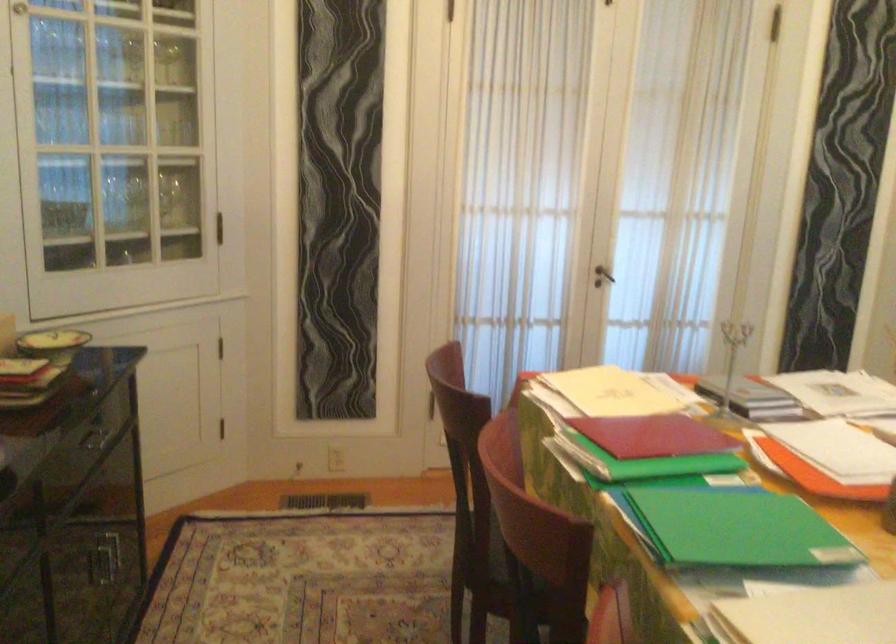
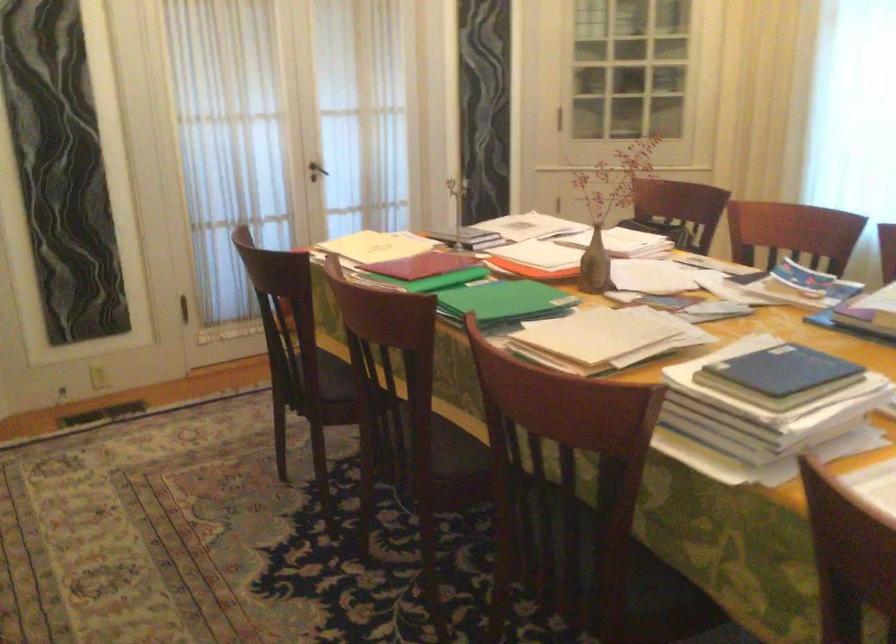
In the second image, find the point that corresponds to [602,277] in the first image.

(316, 171)